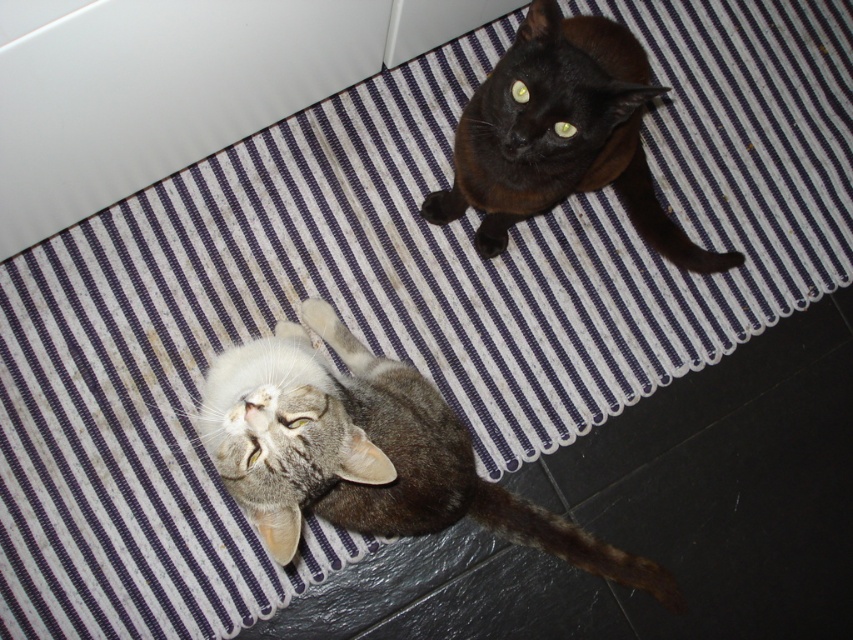
Question: Among these objects, which one is farthest from the camera?

Choices:
 (A) gray tabby cat at lower left
 (B) black glossy cat at upper center

Answer: (B)

Question: Is gray tabby cat at lower left closer to the viewer compared to black glossy cat at upper center?

Choices:
 (A) no
 (B) yes

Answer: (B)

Question: Does gray tabby cat at lower left have a smaller size compared to black glossy cat at upper center?

Choices:
 (A) no
 (B) yes

Answer: (A)

Question: Among these points, which one is nearest to the camera?

Choices:
 (A) (242, 454)
 (B) (517, 56)

Answer: (A)

Question: Does gray tabby cat at lower left have a smaller size compared to black glossy cat at upper center?

Choices:
 (A) yes
 (B) no

Answer: (B)

Question: Which of the following is the closest to the observer?

Choices:
 (A) black glossy cat at upper center
 (B) gray tabby cat at lower left

Answer: (B)